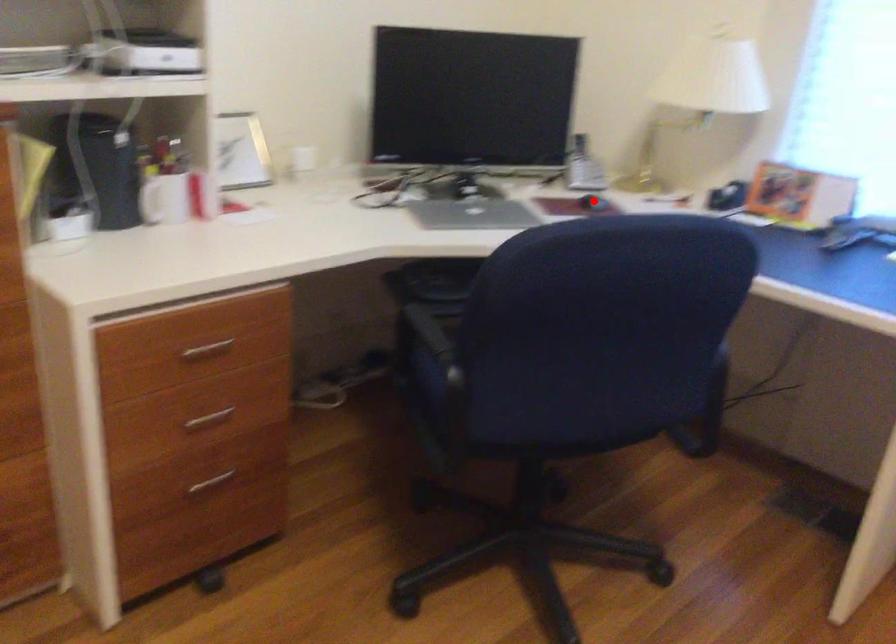
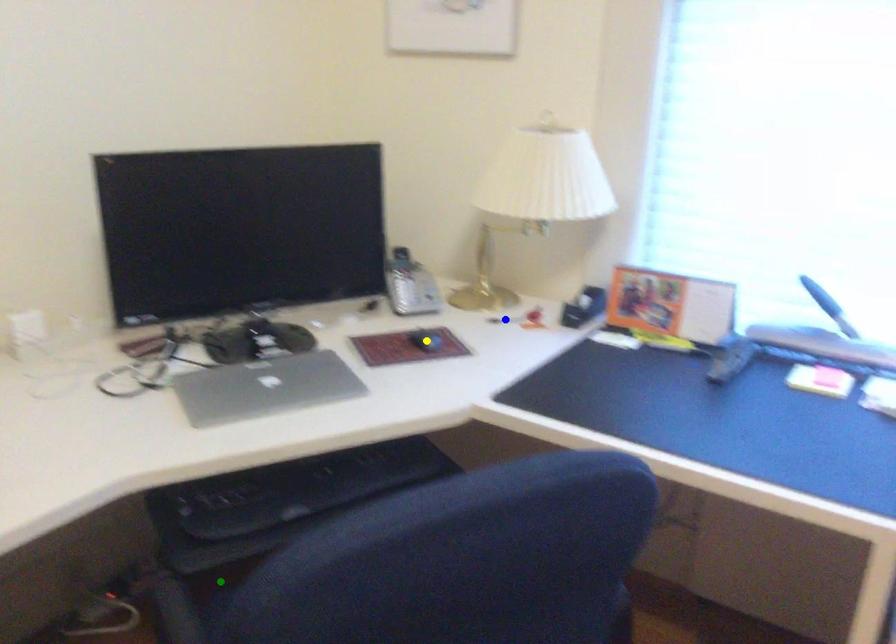
Question: I am providing you with two images of the same scene from different viewpoints. A red point is marked on the first image. You are given multiple points on the second image. Which point in image 2 is actually the same real-world point as the red point in image 1?

Choices:
 (A) yellow point
 (B) blue point
 (C) green point

Answer: (A)